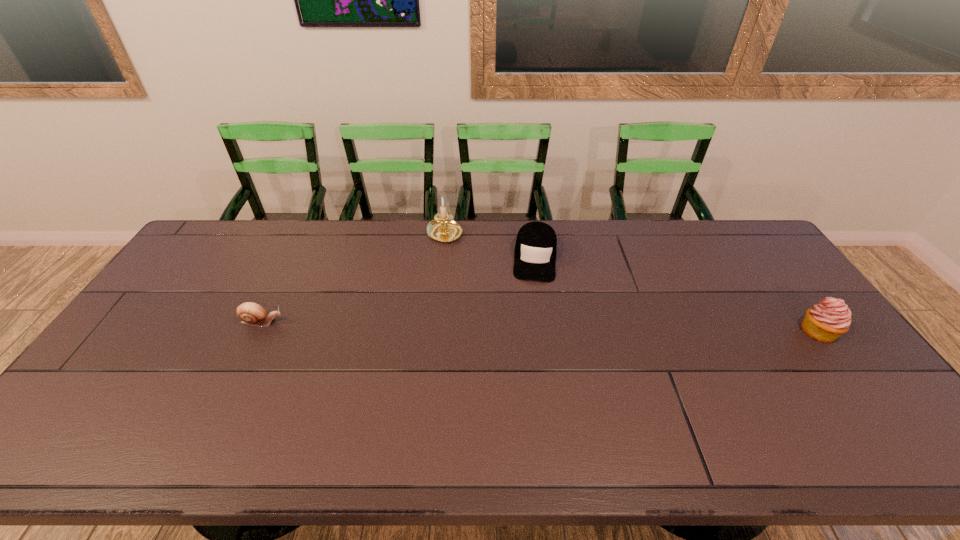
Identify the location of free space between the shortest object and the cap. The width and height of the screenshot is (960, 540). (398, 290).

This screenshot has height=540, width=960. In order to click on vacant area that lies between the shortest object and the rightmost object in this screenshot , I will do `click(540, 327)`.

Locate an element on the screen. The width and height of the screenshot is (960, 540). vacant space that's between the cap and the candle holder is located at coordinates (490, 246).

Locate an element on the screen. vacant space that's between the second object from left to right and the shortest object is located at coordinates (353, 278).

The image size is (960, 540). Find the location of `object that stands as the second closest to the third object from left to right`. object that stands as the second closest to the third object from left to right is located at coordinates (826, 321).

Identify which object is the second nearest to the second tallest object. Please provide its 2D coordinates. Your answer should be formatted as a tuple, i.e. [(x, y)], where the tuple contains the x and y coordinates of a point satisfying the conditions above.

[(443, 228)]

In order to click on free space that satisfies the following two spatial constraints: 1. on the front side of the rightmost object; 2. on the right side of the third object from right to left in this screenshot , I will do point(435,332).

At what (x,y) coordinates should I click in order to perform the action: click on vacant position in the image that satisfies the following two spatial constraints: 1. on the front side of the second tallest object; 2. on the right side of the second object from left to right. Please return your answer as a coordinate pair (x, y). Looking at the image, I should click on (435, 332).